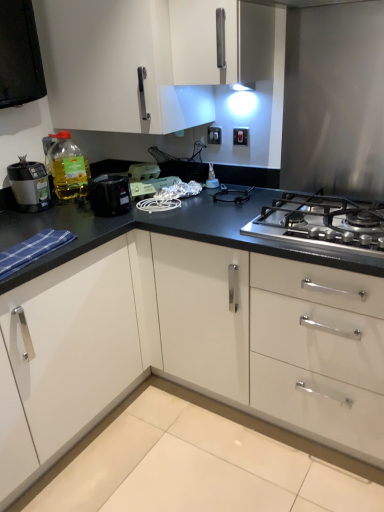
The image size is (384, 512). What do you see at coordinates (109, 195) in the screenshot? I see `matte black toaster at center, which is the second kitchen appliance in left-to-right order` at bounding box center [109, 195].

The image size is (384, 512). Describe the element at coordinates (322, 222) in the screenshot. I see `stainless steel gas stove at center` at that location.

How much space does matte black blender at left, acting as the second kitchen appliance starting from the right, occupy horizontally?

matte black blender at left, acting as the second kitchen appliance starting from the right, is 6.52 inches wide.

At what (x,y) coordinates should I click in order to perform the action: click on translucent yellow bottle at left. Please return your answer as a coordinate pair (x, y). Looking at the image, I should click on (68, 168).

Identify the location of white plastic electric outlet at upper center, the first electric outlet positioned from the right. This screenshot has height=512, width=384. (240, 136).

This screenshot has width=384, height=512. Identify the location of matte black toaster at center, the first kitchen appliance positioned from the right. (109, 195).

Which of these two, white glossy cabinet at upper center or white plastic electric outlet at upper center, which ranks as the 1th electric outlet in back-to-front order, is bigger?

white glossy cabinet at upper center is bigger.

Can you confirm if white glossy cabinet at upper center is wider than white plastic electric outlet at upper center, the first electric outlet viewed from the left?

Yes, white glossy cabinet at upper center is wider than white plastic electric outlet at upper center, the first electric outlet viewed from the left.

From the image's perspective, which object appears higher, white glossy cabinet at upper center or white plastic electric outlet at upper center, which is the second electric outlet in front-to-back order?

white glossy cabinet at upper center is shown above in the image.

Is white glossy cabinet at upper center placed right next to white plastic electric outlet at upper center, which is the second electric outlet in front-to-back order?

No.

In the image, is matte black blender at left, acting as the second kitchen appliance starting from the right, positioned in front of or behind white plastic electric outlet at upper center, marked as the second electric outlet in a left-to-right arrangement?

Clearly, matte black blender at left, acting as the second kitchen appliance starting from the right, is in front of white plastic electric outlet at upper center, marked as the second electric outlet in a left-to-right arrangement.

From a real-world perspective, is matte black blender at left, acting as the second kitchen appliance starting from the right, positioned above or below white plastic electric outlet at upper center, the first electric outlet positioned from the right?

matte black blender at left, acting as the second kitchen appliance starting from the right, is situated lower than white plastic electric outlet at upper center, the first electric outlet positioned from the right, in the real world.

Does matte black blender at left, the 1th kitchen appliance in the left-to-right sequence, contain white plastic electric outlet at upper center, marked as the second electric outlet in a left-to-right arrangement?

That's incorrect, white plastic electric outlet at upper center, marked as the second electric outlet in a left-to-right arrangement, is not inside matte black blender at left, the 1th kitchen appliance in the left-to-right sequence.

What's the angular difference between white plastic electric outlet at upper center, which is the first electric outlet from front to back, and white plastic electric outlet at upper center, which is the second electric outlet in front-to-back order,'s facing directions?

The facing directions of white plastic electric outlet at upper center, which is the first electric outlet from front to back, and white plastic electric outlet at upper center, which is the second electric outlet in front-to-back order, are 0.0174 degrees apart.

Which object is further away from the camera, white plastic electric outlet at upper center, which is the first electric outlet from front to back, or white plastic electric outlet at upper center, the first electric outlet viewed from the left?

white plastic electric outlet at upper center, the first electric outlet viewed from the left.

Which of these two, white plastic electric outlet at upper center, marked as the second electric outlet in a left-to-right arrangement, or white plastic electric outlet at upper center, the first electric outlet viewed from the left, stands taller?

With more height is white plastic electric outlet at upper center, marked as the second electric outlet in a left-to-right arrangement.

Who is bigger, white plastic electric outlet at upper center, the first electric outlet positioned from the right, or white plastic electric outlet at upper center, the first electric outlet viewed from the left?

white plastic electric outlet at upper center, the first electric outlet positioned from the right.

Is stainless steel gas stove at center behind white plastic electric outlet at upper center, marked as the second electric outlet in a left-to-right arrangement?

No, stainless steel gas stove at center is closer to the viewer.

Does stainless steel gas stove at center appear on the left side of white plastic electric outlet at upper center, positioned as the 2th electric outlet in back-to-front order?

Incorrect, stainless steel gas stove at center is not on the left side of white plastic electric outlet at upper center, positioned as the 2th electric outlet in back-to-front order.

Which object is thinner, stainless steel gas stove at center or white plastic electric outlet at upper center, marked as the second electric outlet in a left-to-right arrangement?

white plastic electric outlet at upper center, marked as the second electric outlet in a left-to-right arrangement, is thinner.

Measure the distance between white plastic electric outlet at upper center, positioned as the 2th electric outlet in back-to-front order, and translucent yellow bottle at left.

white plastic electric outlet at upper center, positioned as the 2th electric outlet in back-to-front order, is 32.09 inches from translucent yellow bottle at left.

Is white plastic electric outlet at upper center, the first electric outlet positioned from the right, turned away from translucent yellow bottle at left?

No, white plastic electric outlet at upper center, the first electric outlet positioned from the right,'s orientation is not away from translucent yellow bottle at left.

How many degrees apart are the facing directions of white plastic electric outlet at upper center, which is the first electric outlet from front to back, and translucent yellow bottle at left?

The facing directions of white plastic electric outlet at upper center, which is the first electric outlet from front to back, and translucent yellow bottle at left are 62.9 degrees apart.

Which is correct: white plastic electric outlet at upper center, the first electric outlet positioned from the right, is inside translucent yellow bottle at left, or outside of it?

The correct answer is: outside.

Is translucent yellow bottle at left bigger or smaller than white plastic electric outlet at upper center, the first electric outlet positioned from the right?

translucent yellow bottle at left is bigger than white plastic electric outlet at upper center, the first electric outlet positioned from the right.

Considering the positions of objects translucent yellow bottle at left and white plastic electric outlet at upper center, which is the first electric outlet from front to back, in the image provided, who is in front, translucent yellow bottle at left or white plastic electric outlet at upper center, which is the first electric outlet from front to back,?

translucent yellow bottle at left.

Visually, is translucent yellow bottle at left positioned to the left or to the right of white plastic electric outlet at upper center, which is the first electric outlet from front to back?

From the image, it's evident that translucent yellow bottle at left is to the left of white plastic electric outlet at upper center, which is the first electric outlet from front to back.

You are a GUI agent. You are given a task and a screenshot of the screen. Output one action in this format:
    pyautogui.click(x=<x>, y=<y>)
    Task: Click on the gas stove that appears below the matte black toaster at center, which is the second kitchen appliance in left-to-right order (from a real-world perspective)
    
    Given the screenshot: What is the action you would take?
    pyautogui.click(x=322, y=222)

Is stainless steel gas stove at center spatially inside matte black toaster at center, which is the second kitchen appliance in left-to-right order, or outside of it?

stainless steel gas stove at center is not enclosed by matte black toaster at center, which is the second kitchen appliance in left-to-right order.

Who is taller, stainless steel gas stove at center or matte black toaster at center, which is the second kitchen appliance in left-to-right order?

matte black toaster at center, which is the second kitchen appliance in left-to-right order.

From the image's perspective, does stainless steel gas stove at center appear lower than matte black toaster at center, which is the second kitchen appliance in left-to-right order?

Indeed, from the image's perspective, stainless steel gas stove at center is shown beneath matte black toaster at center, which is the second kitchen appliance in left-to-right order.

Starting from the white glossy cabinet at upper center, which electric outlet is the 2nd one behind? Please provide its 2D coordinates.

[(214, 135)]

You are a GUI agent. You are given a task and a screenshot of the screen. Output one action in this format:
    pyautogui.click(x=<x>, y=<y>)
    Task: Click on the 1st kitchen appliance in front of the white plastic electric outlet at upper center, the first electric outlet positioned from the right
    The width and height of the screenshot is (384, 512).
    Given the screenshot: What is the action you would take?
    pyautogui.click(x=30, y=185)

Considering their positions, is white plastic electric outlet at upper center, the first electric outlet viewed from the left, positioned further to stainless steel gas stove at center than white glossy cabinet at upper center?

white glossy cabinet at upper center.

From the image, which object appears to be farther from matte black toaster at center, the first kitchen appliance positioned from the right, white plastic electric outlet at upper center, which is the first electric outlet from front to back, or white glossy cabinet at upper center?

The object further to matte black toaster at center, the first kitchen appliance positioned from the right, is white plastic electric outlet at upper center, which is the first electric outlet from front to back.

Which object lies further to the anchor point matte black toaster at center, the first kitchen appliance positioned from the right, white glossy cabinet at upper center or white plastic electric outlet at upper center, which is the 2th electric outlet in right-to-left order?

Among the two, white plastic electric outlet at upper center, which is the 2th electric outlet in right-to-left order, is located further to matte black toaster at center, the first kitchen appliance positioned from the right.

Based on their spatial positions, is white glossy cabinet at upper center or matte black toaster at center, the first kitchen appliance positioned from the right, further from white plastic electric outlet at upper center, marked as the second electric outlet in a left-to-right arrangement?

matte black toaster at center, the first kitchen appliance positioned from the right, is positioned further to the anchor white plastic electric outlet at upper center, marked as the second electric outlet in a left-to-right arrangement.

When comparing their distances from stainless steel gas stove at center, does matte black toaster at center, which is the second kitchen appliance in left-to-right order, or matte black blender at left, the 1th kitchen appliance in the left-to-right sequence, seem closer?

Based on the image, matte black toaster at center, which is the second kitchen appliance in left-to-right order, appears to be nearer to stainless steel gas stove at center.

Based on their spatial positions, is stainless steel gas stove at center or white glossy cabinet at upper center closer to white plastic electric outlet at upper center, which is the first electric outlet from front to back?

white glossy cabinet at upper center lies closer to white plastic electric outlet at upper center, which is the first electric outlet from front to back, than the other object.

Estimate the real-world distances between objects in this image. Which object is further from translucent yellow bottle at left, white plastic electric outlet at upper center, which is the first electric outlet from front to back, or white glossy cabinet at upper center?

Among the two, white plastic electric outlet at upper center, which is the first electric outlet from front to back, is located further to translucent yellow bottle at left.

From the image, which object appears to be nearer to matte black blender at left, acting as the second kitchen appliance starting from the right, white glossy cabinet at upper center or stainless steel gas stove at center?

The object closer to matte black blender at left, acting as the second kitchen appliance starting from the right, is white glossy cabinet at upper center.

Where is `bottle located between matte black blender at left, the 1th kitchen appliance in the left-to-right sequence, and white plastic electric outlet at upper center, which is the 2th electric outlet in right-to-left order, in the left-right direction`? bottle located between matte black blender at left, the 1th kitchen appliance in the left-to-right sequence, and white plastic electric outlet at upper center, which is the 2th electric outlet in right-to-left order, in the left-right direction is located at coordinates (68, 168).

The image size is (384, 512). What are the coordinates of `kitchen appliance between translucent yellow bottle at left and white plastic electric outlet at upper center, the first electric outlet positioned from the right, from left to right` in the screenshot? It's located at (109, 195).

Identify the location of bottle between matte black blender at left, the 1th kitchen appliance in the left-to-right sequence, and white plastic electric outlet at upper center, marked as the second electric outlet in a left-to-right arrangement, in the horizontal direction. (68, 168).

Locate an element on the screen. The height and width of the screenshot is (512, 384). kitchen appliance between translucent yellow bottle at left and white plastic electric outlet at upper center, which is the 2th electric outlet in right-to-left order, in the horizontal direction is located at coordinates point(109,195).